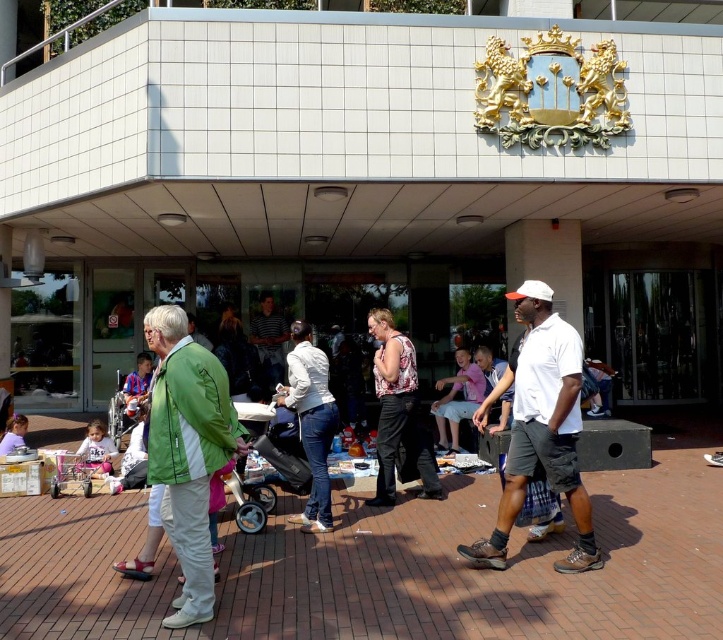
You are helping organize a clothing sale and need to place the pink cotton shirt at center and the matte blue shirt at lower left on a rack. Which shirt should you place on the narrower hanger?

The pink cotton shirt at center has a lesser width compared to the matte blue shirt at lower left, so it should be placed on the narrower hanger.

You are a customer at the market and want to buy the pink cotton shirt at center. However, you notice another shirt, the matte blue shirt at lower left. Which shirt is closer to you?

The pink cotton shirt at center is closer to you because the matte blue shirt at lower left is behind it.